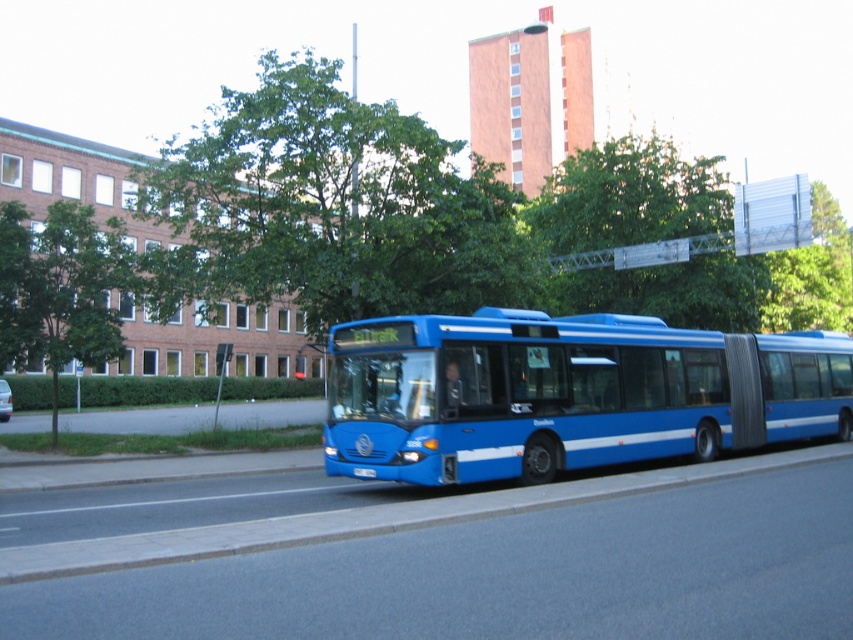
Question: Is green leafy tree at upper center positioned at the back of green leafy tree at upper right?

Choices:
 (A) yes
 (B) no

Answer: (A)

Question: Among these objects, which one is farthest from the camera?

Choices:
 (A) gray asphalt curb at lower center
 (B) green leafy tree at left

Answer: (B)

Question: Does blue metallic bus at center have a lesser width compared to gray asphalt curb at lower center?

Choices:
 (A) yes
 (B) no

Answer: (A)

Question: Which of the following is the closest to the observer?

Choices:
 (A) (567, 337)
 (B) (612, 476)

Answer: (A)

Question: Can you confirm if blue metallic bus at center is bigger than green leafy tree at left?

Choices:
 (A) no
 (B) yes

Answer: (A)

Question: Estimate the real-world distances between objects in this image. Which object is farther from the green leafy tree at upper center?

Choices:
 (A) gray asphalt curb at lower center
 (B) green leafy tree at left
 (C) blue metallic bus at center
 (D) green leafy tree at upper right

Answer: (B)